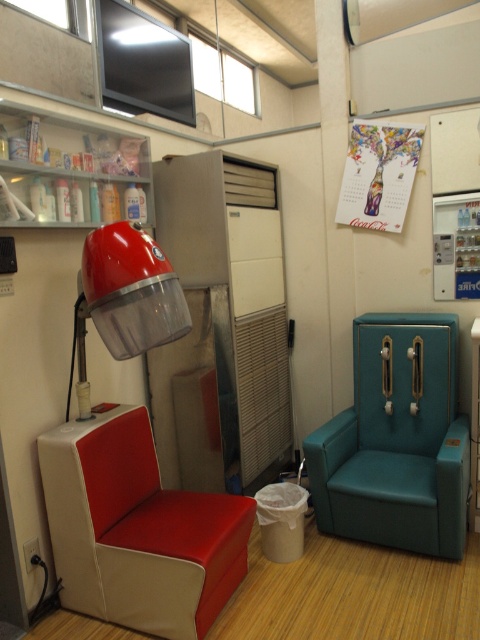
Question: Which point is closer to the camera?

Choices:
 (A) (168, 538)
 (B) (135, 305)

Answer: (B)

Question: Which point is farther from the camera taking this photo?

Choices:
 (A) (162, 269)
 (B) (419, 376)

Answer: (B)

Question: Observing the image, what is the correct spatial positioning of red leather armchair at left in reference to teal leather chair at right?

Choices:
 (A) below
 (B) above

Answer: (A)

Question: Among these points, which one is farthest from the camera?

Choices:
 (A) (165, 611)
 (B) (134, 221)

Answer: (B)

Question: Does teal leather chair at right appear on the right side of matte red hairdryer at left?

Choices:
 (A) yes
 (B) no

Answer: (A)

Question: Can you confirm if red leather armchair at left is positioned above teal leather chair at right?

Choices:
 (A) yes
 (B) no

Answer: (B)